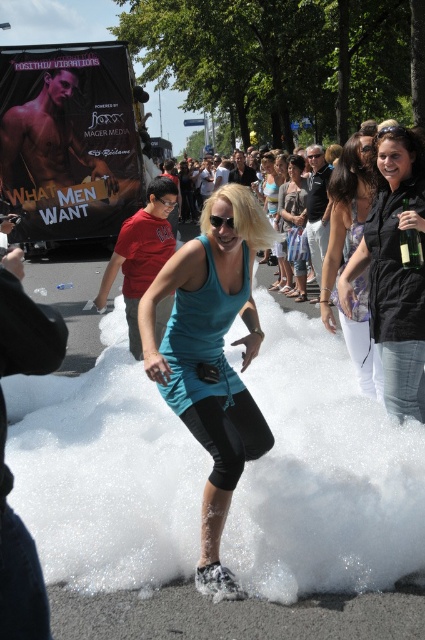
You are a photographer at the event and want to capture a clear photo of the light purple sheer blouse at center and transparent plastic goggles at center. Which object should you focus on first if you want to ensure both are in focus, considering their heights?

The light purple sheer blouse at center has a greater height compared to transparent plastic goggles at center, so you should focus on the light purple sheer blouse at center first to ensure both are in focus.

You are a photographer at the event and need to capture both the teal fabric dress at center and the clear glass bottle at center in a single frame. Considering their sizes, which object should you focus on to ensure both fit in the photo without cropping?

The teal fabric dress at center is wider than the clear glass bottle at center, so focusing on the teal fabric dress at center will ensure both objects fit in the frame without cropping.